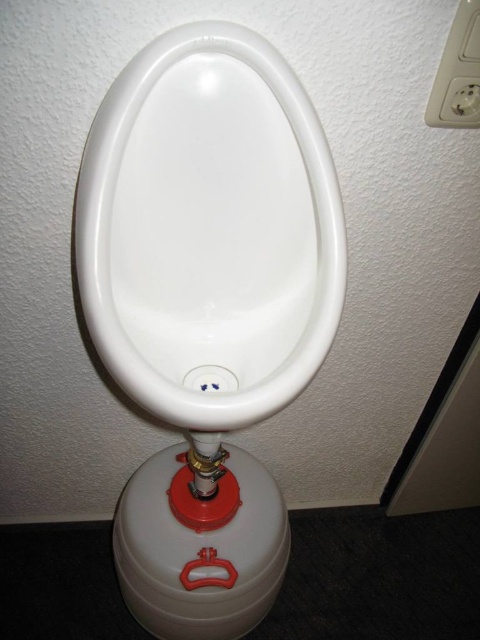
Question: Does white glossy urinal at center have a smaller size compared to white plastic outlet at upper right?

Choices:
 (A) no
 (B) yes

Answer: (A)

Question: Which point is closer to the camera?

Choices:
 (A) (440, 97)
 (B) (316, 268)

Answer: (B)

Question: Is white glossy urinal at center to the right of white plastic outlet at upper right from the viewer's perspective?

Choices:
 (A) yes
 (B) no

Answer: (B)

Question: Which of the following is the farthest from the observer?

Choices:
 (A) (180, 243)
 (B) (463, 49)

Answer: (A)

Question: Is white glossy urinal at center thinner than white plastic outlet at upper right?

Choices:
 (A) no
 (B) yes

Answer: (A)

Question: Among these points, which one is farthest from the camera?

Choices:
 (A) (446, 90)
 (B) (239, 156)

Answer: (A)